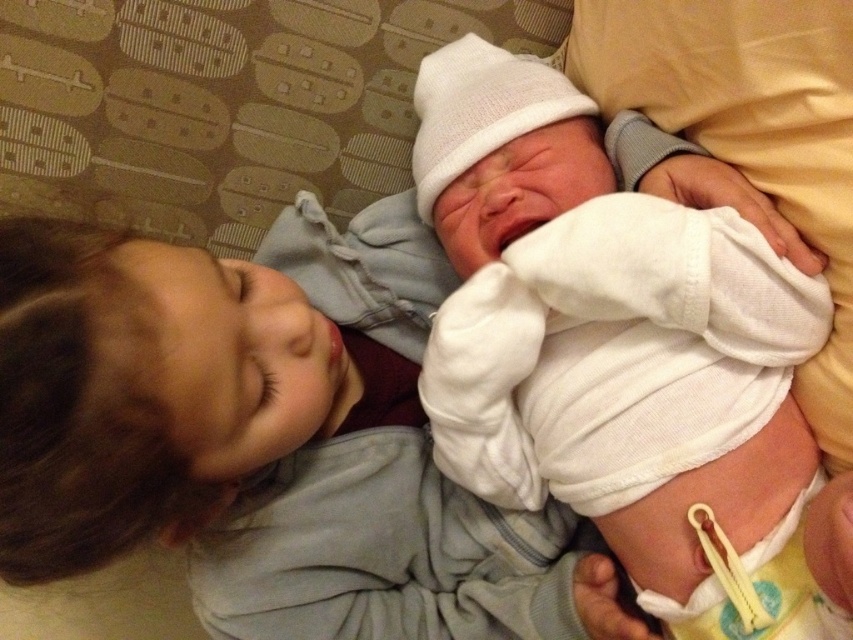
Which is more to the right, white soft cloth at center or white cotton newborn at center?

white cotton newborn at center is more to the right.

The width and height of the screenshot is (853, 640). Describe the element at coordinates (263, 436) in the screenshot. I see `white soft cloth at center` at that location.

This screenshot has height=640, width=853. I want to click on white soft cloth at center, so click(x=263, y=436).